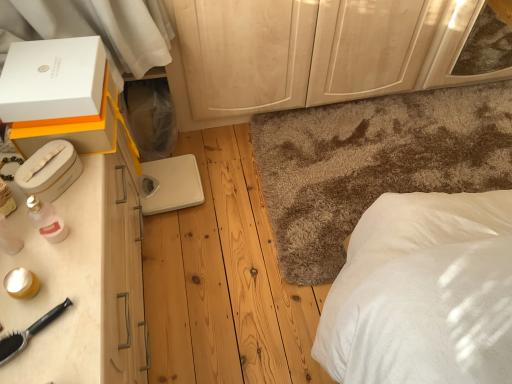
At what (x,y) coordinates should I click in order to perform the action: click on free location to the right of black plastic brush at lower left. Please return your answer as a coordinate pair (x, y). The image size is (512, 384). Looking at the image, I should click on (74, 332).